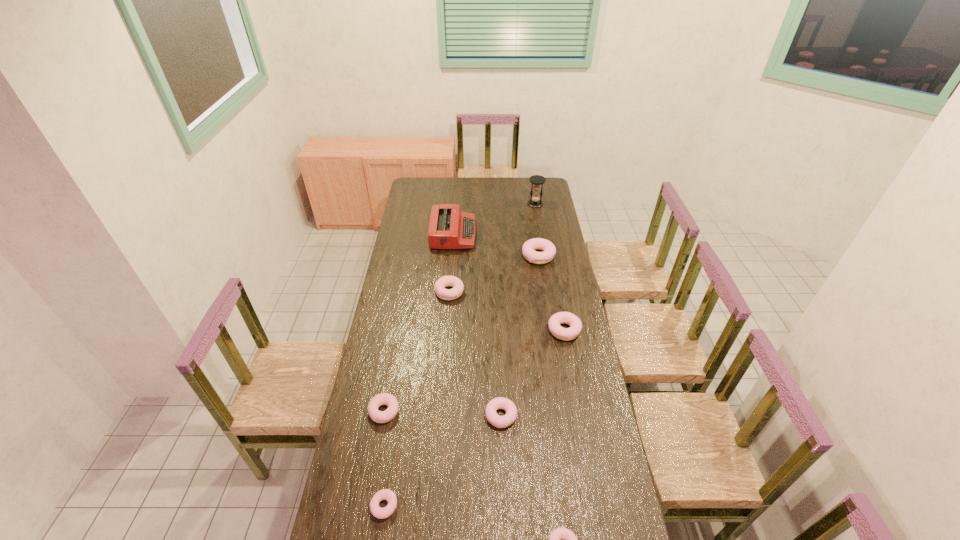
Where is `free space located 0.100m on the right of the second nearest purple doughnut`? This screenshot has height=540, width=960. free space located 0.100m on the right of the second nearest purple doughnut is located at coordinates (426, 411).

At what (x,y) coordinates should I click in order to perform the action: click on vacant point located on the back of the third farthest pink doughnut. Please return your answer as a coordinate pair (x, y). Looking at the image, I should click on (499, 362).

I want to click on free space located 0.080m on the back of the nearest purple doughnut, so 390,468.

Locate an element on the screen. The image size is (960, 540). hourglass present at the right edge is located at coordinates (535, 202).

Find the location of a particular element. vacant area at the far edge is located at coordinates (504, 197).

The height and width of the screenshot is (540, 960). I want to click on vacant space at the left edge of the desktop, so click(x=387, y=352).

At what (x,y) coordinates should I click in order to perform the action: click on vacant space at the right edge of the desktop. Please return your answer as a coordinate pair (x, y). This screenshot has height=540, width=960. Looking at the image, I should click on (569, 307).

In the image, there is a desktop. At what (x,y) coordinates should I click in order to perform the action: click on free space at the far left corner. Please return your answer as a coordinate pair (x, y). This screenshot has width=960, height=540. Looking at the image, I should click on (428, 193).

This screenshot has height=540, width=960. I want to click on blank region between the third smallest pink doughnut and the black hourglass, so click(x=550, y=267).

Where is `vacant space that's between the second farthest pink doughnut and the biggest purple doughnut`? The height and width of the screenshot is (540, 960). vacant space that's between the second farthest pink doughnut and the biggest purple doughnut is located at coordinates (507, 311).